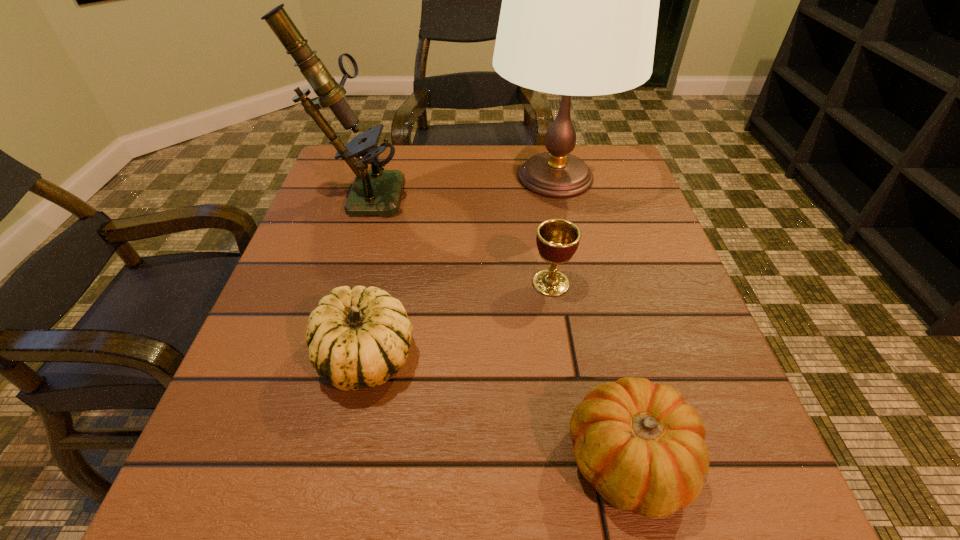
Find the location of a particular element. vacant space that's between the third farthest object and the shortest object is located at coordinates (589, 372).

Locate an element on the screen. Image resolution: width=960 pixels, height=540 pixels. empty space that is in between the third farthest object and the taller gourd is located at coordinates (458, 320).

In order to click on vacant area that lies between the taller gourd and the shorter gourd in this screenshot , I will do `click(497, 409)`.

Where is `free spot between the shortest object and the microscope`? This screenshot has height=540, width=960. free spot between the shortest object and the microscope is located at coordinates [494, 326].

Locate which object is the third closest to the right gourd. Please provide its 2D coordinates. Your answer should be formatted as a tuple, i.e. [(x, y)], where the tuple contains the x and y coordinates of a point satisfying the conditions above.

[(580, 0)]

The height and width of the screenshot is (540, 960). I want to click on the closest object to the third farthest object, so click(580, 0).

The image size is (960, 540). Identify the location of free space in the image that satisfies the following two spatial constraints: 1. at the eyepiece of the second tallest object; 2. on the right side of the right gourd. (271, 460).